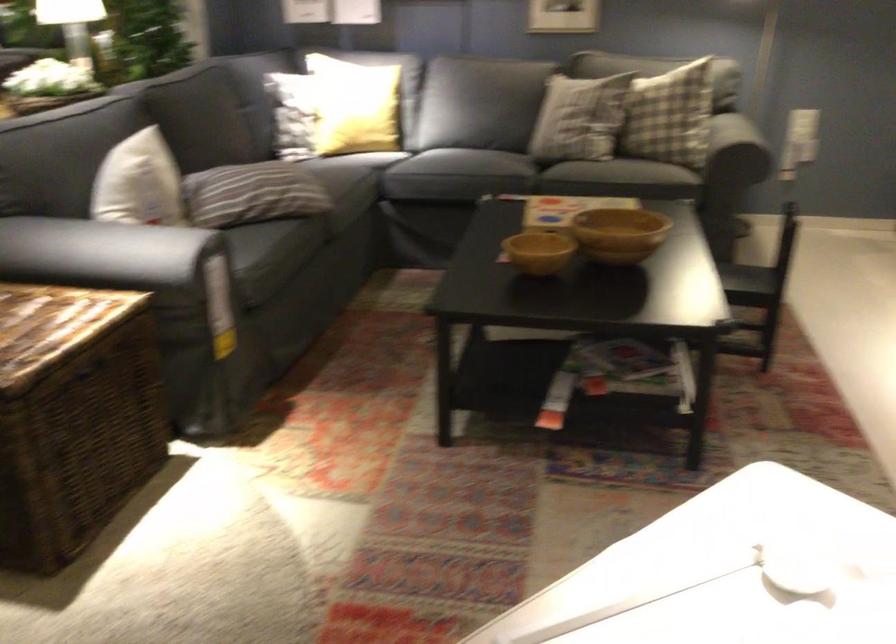
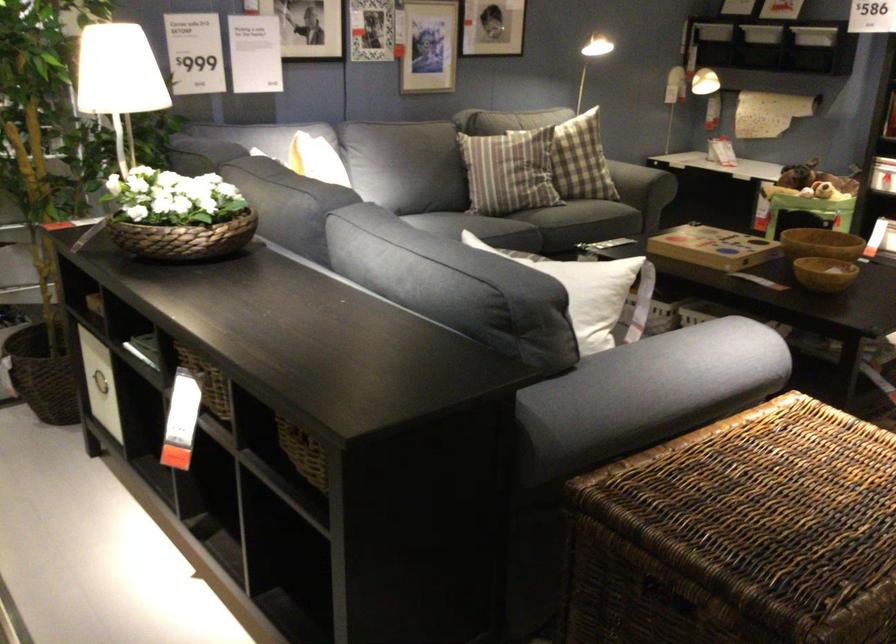
Question: I am providing you with two images of the same scene from different viewpoints. Which of the following objects are not visible in image2?

Choices:
 (A) woven flower basket
 (B) stainless steel canister
 (C) striped pillow
 (D) yellow pillow

Answer: (D)